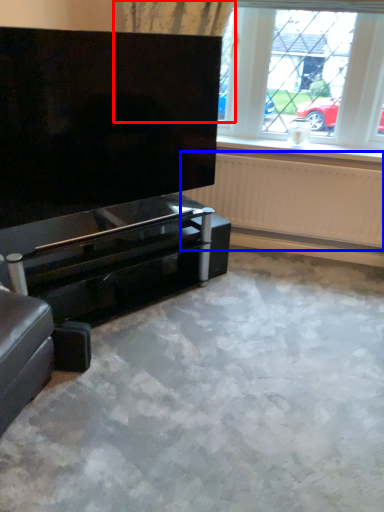
Question: Which object appears farthest to the camera in this image, curtain (highlighted by a red box) or radiator (highlighted by a blue box)?

Choices:
 (A) curtain
 (B) radiator

Answer: (B)